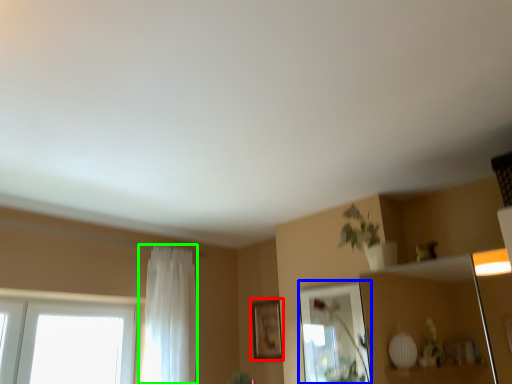
Question: Considering the real-world distances, which object is closest to picture frame (highlighted by a red box)? mirror (highlighted by a blue box) or curtain (highlighted by a green box).

Choices:
 (A) mirror
 (B) curtain

Answer: (A)